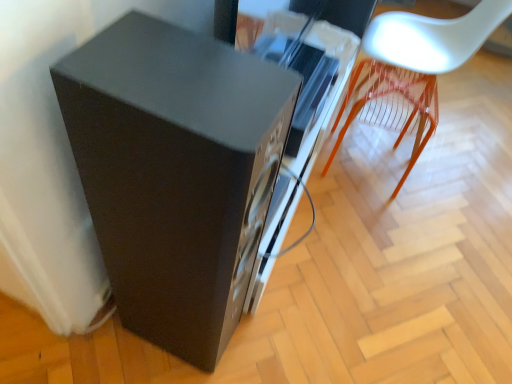
What are the coordinates of `free space in front of matte black speaker at lower left` in the screenshot? It's located at (150, 366).